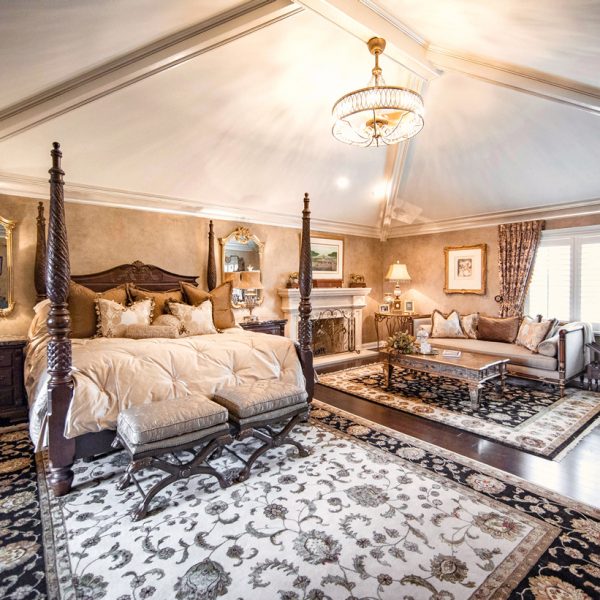
You are a GUI agent. You are given a task and a screenshot of the screen. Output one action in this format:
    pyautogui.click(x=<x>, y=<y>)
    Task: Click on the couch
    
    Given the screenshot: What is the action you would take?
    pyautogui.click(x=511, y=352)